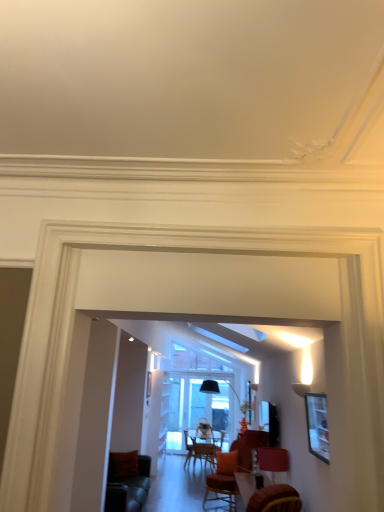
What do you see at coordinates (273, 460) in the screenshot? I see `matte red lampshade at lower right` at bounding box center [273, 460].

Measure the distance between matte red lampshade at lower right and camera.

The depth of matte red lampshade at lower right is 14.17 feet.

Find the location of a particular element. The width and height of the screenshot is (384, 512). matte red lampshade at lower right is located at coordinates (273, 460).

Looking at this image, measure the distance between matte black picture frame at right and camera.

matte black picture frame at right is 2.58 meters away from camera.

You are a GUI agent. You are given a task and a screenshot of the screen. Output one action in this format:
    pyautogui.click(x=<x>, y=<y>)
    Task: Click on the matte black picture frame at right
    
    Given the screenshot: What is the action you would take?
    pyautogui.click(x=317, y=425)

What do you see at coordinates (317, 425) in the screenshot?
I see `matte black picture frame at right` at bounding box center [317, 425].

Image resolution: width=384 pixels, height=512 pixels. I want to click on matte red lampshade at lower right, so click(273, 460).

Visually, is matte red lampshade at lower right positioned to the left or to the right of matte black picture frame at right?

matte red lampshade at lower right is positioned on matte black picture frame at right's left side.

Considering the positions of objects matte red lampshade at lower right and matte black picture frame at right in the image provided, who is in front, matte red lampshade at lower right or matte black picture frame at right?

matte black picture frame at right is closer to the camera.

Which is behind, point (288, 456) or point (321, 449)?

The point (288, 456) is more distant.

In the scene shown: From the image's perspective, who appears lower, matte red lampshade at lower right or matte black picture frame at right?

From the image's view, matte red lampshade at lower right is below.

From a real-world perspective, is matte red lampshade at lower right positioned above or below matte black picture frame at right?

Clearly, from a real-world perspective, matte red lampshade at lower right is below matte black picture frame at right.

Does matte red lampshade at lower right have a greater width compared to matte black picture frame at right?

Yes, matte red lampshade at lower right is wider than matte black picture frame at right.

From their relative heights in the image, would you say matte red lampshade at lower right is taller or shorter than matte black picture frame at right?

Clearly, matte red lampshade at lower right is shorter compared to matte black picture frame at right.

Is matte red lampshade at lower right bigger or smaller than matte black picture frame at right?

Considering their sizes, matte red lampshade at lower right takes up more space than matte black picture frame at right.

Is matte red lampshade at lower right positioned beyond the bounds of matte black picture frame at right?

Yes, matte red lampshade at lower right is not within matte black picture frame at right.

Is matte red lampshade at lower right next to matte black picture frame at right and touching it?

matte red lampshade at lower right and matte black picture frame at right are clearly separated.

From the picture: Is matte red lampshade at lower right oriented away from matte black picture frame at right?

matte red lampshade at lower right does not have its back to matte black picture frame at right.

What's the angular difference between matte red lampshade at lower right and matte black picture frame at right's facing directions?

matte red lampshade at lower right and matte black picture frame at right are facing 0.964 degrees away from each other.

How much distance is there between matte red lampshade at lower right and matte black picture frame at right?

They are 1.48 meters apart.

The image size is (384, 512). Find the location of `picture frame above the matte red lampshade at lower right (from a real-world perspective)`. picture frame above the matte red lampshade at lower right (from a real-world perspective) is located at coordinates click(x=317, y=425).

Considering the relative positions of matte black picture frame at right and matte red lampshade at lower right in the image provided, is matte black picture frame at right to the left of matte red lampshade at lower right from the viewer's perspective?

In fact, matte black picture frame at right is to the right of matte red lampshade at lower right.

Is the depth of matte black picture frame at right greater than that of matte red lampshade at lower right?

No, it is in front of matte red lampshade at lower right.

Considering the points (326, 440) and (261, 451), which point is in front, point (326, 440) or point (261, 451)?

Point (326, 440)

From the image's perspective, between matte black picture frame at right and matte red lampshade at lower right, who is located below?

matte red lampshade at lower right appears lower in the image.

From a real-world perspective, which is physically above, matte black picture frame at right or matte red lampshade at lower right?

From a 3D spatial view, matte black picture frame at right is above.

Can you confirm if matte black picture frame at right is wider than matte red lampshade at lower right?

In fact, matte black picture frame at right might be narrower than matte red lampshade at lower right.

Does matte black picture frame at right have a greater height compared to matte red lampshade at lower right?

Yes, matte black picture frame at right is taller than matte red lampshade at lower right.

Considering the relative sizes of matte black picture frame at right and matte red lampshade at lower right in the image provided, is matte black picture frame at right smaller than matte red lampshade at lower right?

Yes.

Is matte black picture frame at right spatially inside matte red lampshade at lower right, or outside of it?

The correct answer is: outside.

Is matte black picture frame at right not close to matte red lampshade at lower right?

Absolutely, matte black picture frame at right is distant from matte red lampshade at lower right.

Could you tell me if matte black picture frame at right is facing matte red lampshade at lower right?

No, matte black picture frame at right is not oriented towards matte red lampshade at lower right.

How different are the orientations of matte black picture frame at right and matte red lampshade at lower right in degrees?

They differ by 0.964 degrees in their facing directions.

I want to click on picture frame lying on the right of matte red lampshade at lower right, so click(317, 425).

Locate an element on the screen. Image resolution: width=384 pixels, height=512 pixels. picture frame in front of the matte red lampshade at lower right is located at coordinates (317, 425).

You are a GUI agent. You are given a task and a screenshot of the screen. Output one action in this format:
    pyautogui.click(x=<x>, y=<y>)
    Task: Click on the picture frame that appears above the matte red lampshade at lower right (from the image's perspective)
    The image size is (384, 512).
    Given the screenshot: What is the action you would take?
    pyautogui.click(x=317, y=425)